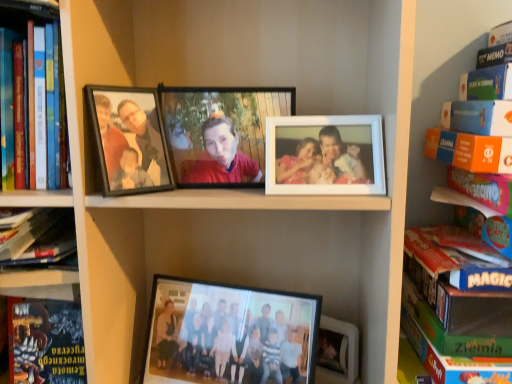
Question: Is black matte photo frame at upper left, marked as the 1th picture frame in a left-to-right arrangement, wider than matte black photo frame at center, arranged as the second picture frame when viewed from the left?

Choices:
 (A) no
 (B) yes

Answer: (B)

Question: From the image's perspective, is black matte photo frame at upper left, marked as the 1th picture frame in a left-to-right arrangement, above matte black photo frame at center, the first picture frame from the right?

Choices:
 (A) yes
 (B) no

Answer: (B)

Question: Can you confirm if black matte photo frame at upper left, marked as the 1th picture frame in a left-to-right arrangement, is positioned to the right of matte black photo frame at center, the first picture frame from the right?

Choices:
 (A) no
 (B) yes

Answer: (A)

Question: Is black matte photo frame at upper left, positioned as the second picture frame in right-to-left order, at the left side of matte black photo frame at center, arranged as the second picture frame when viewed from the left?

Choices:
 (A) no
 (B) yes

Answer: (B)

Question: From a real-world perspective, does black matte photo frame at upper left, positioned as the second picture frame in right-to-left order, stand above matte black photo frame at center, the first picture frame from the right?

Choices:
 (A) no
 (B) yes

Answer: (B)

Question: Is black matte photo frame at upper left, positioned as the second picture frame in right-to-left order, smaller than matte black photo frame at center, arranged as the second picture frame when viewed from the left?

Choices:
 (A) no
 (B) yes

Answer: (B)

Question: Considering the relative sizes of green cardboard book at right, which ranks as the 1th book in right-to-left order, and black matte photo frame at upper left, positioned as the second picture frame in right-to-left order, in the image provided, is green cardboard book at right, which ranks as the 1th book in right-to-left order, bigger than black matte photo frame at upper left, positioned as the second picture frame in right-to-left order,?

Choices:
 (A) no
 (B) yes

Answer: (B)

Question: Considering the relative positions of green cardboard book at right, which is the fourth book from left to right, and black matte photo frame at upper left, positioned as the second picture frame in right-to-left order, in the image provided, is green cardboard book at right, which is the fourth book from left to right, to the right of black matte photo frame at upper left, positioned as the second picture frame in right-to-left order, from the viewer's perspective?

Choices:
 (A) yes
 (B) no

Answer: (A)

Question: From the image's perspective, is green cardboard book at right, which is the fourth book from left to right, on black matte photo frame at upper left, positioned as the second picture frame in right-to-left order?

Choices:
 (A) yes
 (B) no

Answer: (B)

Question: Is green cardboard book at right, which ranks as the 1th book in right-to-left order, thinner than black matte photo frame at upper left, positioned as the second picture frame in right-to-left order?

Choices:
 (A) no
 (B) yes

Answer: (A)

Question: Is green cardboard book at right, which is the fourth book from left to right, oriented away from black matte photo frame at upper left, marked as the 1th picture frame in a left-to-right arrangement?

Choices:
 (A) yes
 (B) no

Answer: (B)

Question: Considering the relative positions of green cardboard book at right, which ranks as the 1th book in right-to-left order, and black matte photo frame at upper left, marked as the 1th picture frame in a left-to-right arrangement, in the image provided, is green cardboard book at right, which ranks as the 1th book in right-to-left order, to the left of black matte photo frame at upper left, marked as the 1th picture frame in a left-to-right arrangement, from the viewer's perspective?

Choices:
 (A) no
 (B) yes

Answer: (A)

Question: Would you say hardcover book at lower left is outside hardcover book at left, arranged as the third book when viewed from the left?

Choices:
 (A) yes
 (B) no

Answer: (A)